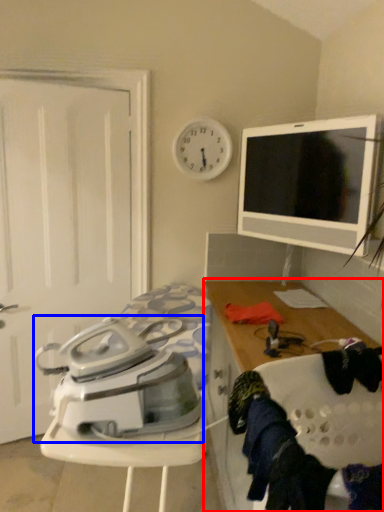
Question: Among these objects, which one is nearest to the camera, cabinetry (highlighted by a red box) or home appliance (highlighted by a blue box)?

Choices:
 (A) cabinetry
 (B) home appliance

Answer: (A)